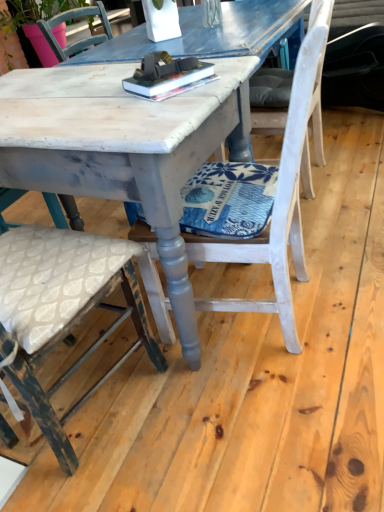
What are the coordinates of `free space above hardcover book at center (from a real-world perspective)` in the screenshot? It's located at (174, 71).